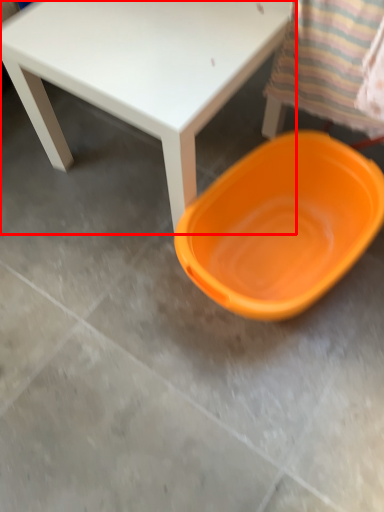
Question: From the image's perspective, what is the correct spatial positioning of table (annotated by the red box) in reference to plate?

Choices:
 (A) above
 (B) below

Answer: (A)